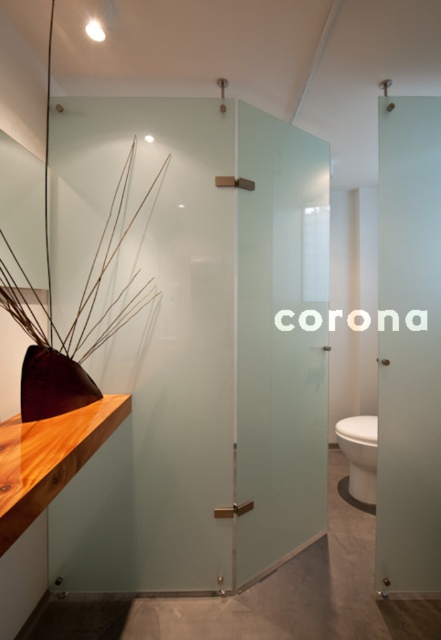
You are standing in the modern bathroom and want to exit through the door. Where is the satin glass screen door at right located in relation to the shower enclosure?

The satin glass screen door at right is located at point (408, 346) relative to the shower enclosure, which means it is positioned to the right and slightly below the shower enclosure in the bathroom.

You are designing a bathroom layout and need to place both the frosted glass screen door at center and the satin glass screen door at right. If you have limited space, which door should you place first to ensure both fit?

You should place the satin glass screen door at right first because it is smaller than the frosted glass screen door at center, allowing more flexibility for arranging both doors in the limited space.

You are a delivery person holding a package that is 2 meters long. You need to bring it through the frosted glass screen door at center. Can you fit the package through the doorway without tilting it?

The distance between the frosted glass screen door at center and the camera is 2.09 meters. Since the package is 2 meters long, it can fit through the doorway without tilting as the available space is slightly longer than the package.